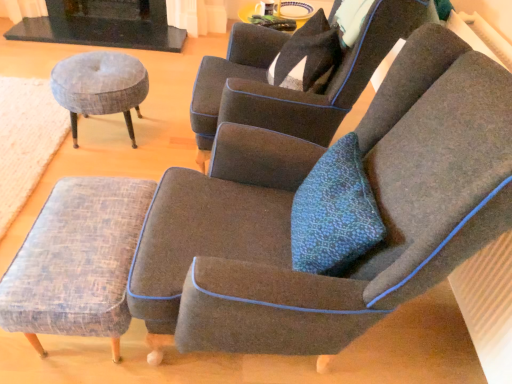
Image resolution: width=512 pixels, height=384 pixels. I want to click on free space above textured gray fabric stool at left, arranged as the first stool when viewed from the back (from a real-world perspective), so click(x=100, y=68).